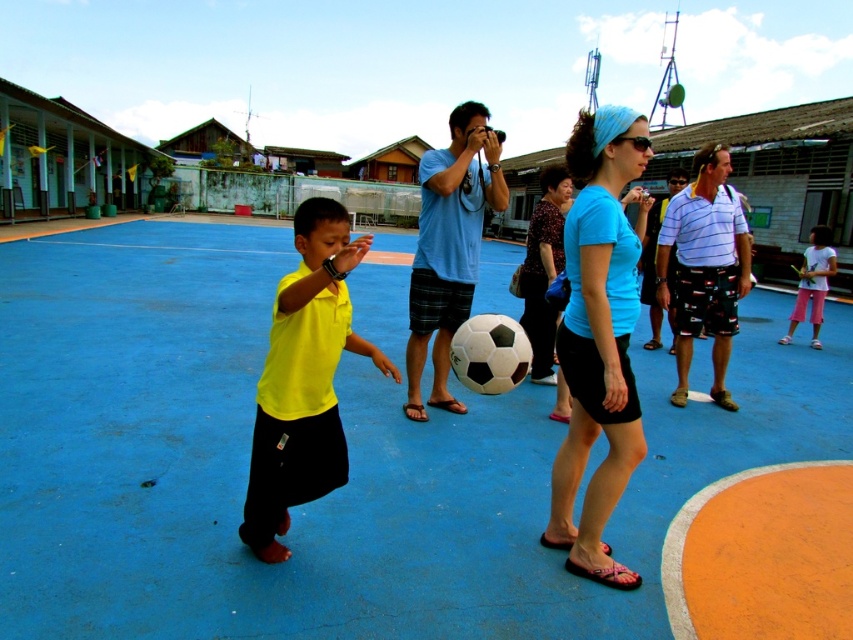
In the image of the sports court, there is a young boy in a bright yellow shirt and black shorts near a black and white soccer ball. There are also adults around. Where is the point at coordinates (599, 339) located?

The point at coordinates (599, 339) corresponds to the light blue t shirt at center.